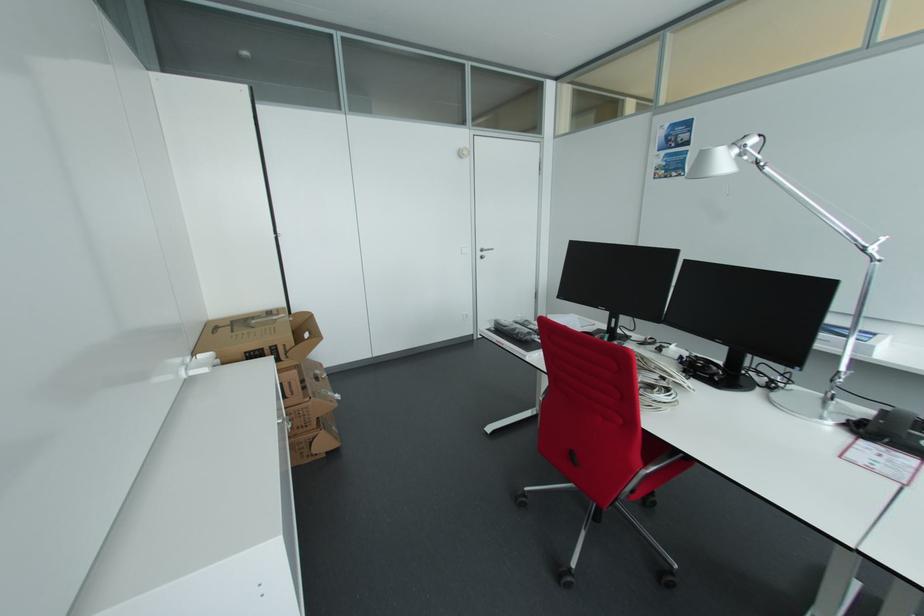
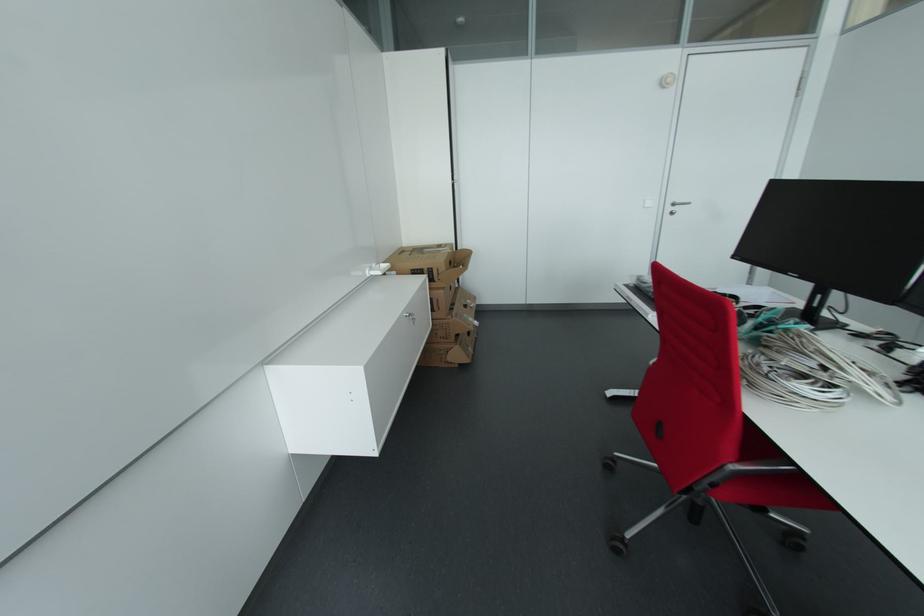
Question: The camera is either moving clockwise (left) or counter-clockwise (right) around the object. The first image is from the beginning of the video and the second image is from the end. Is the camera moving left or right when shooting the video?

Choices:
 (A) Left
 (B) Right

Answer: (B)